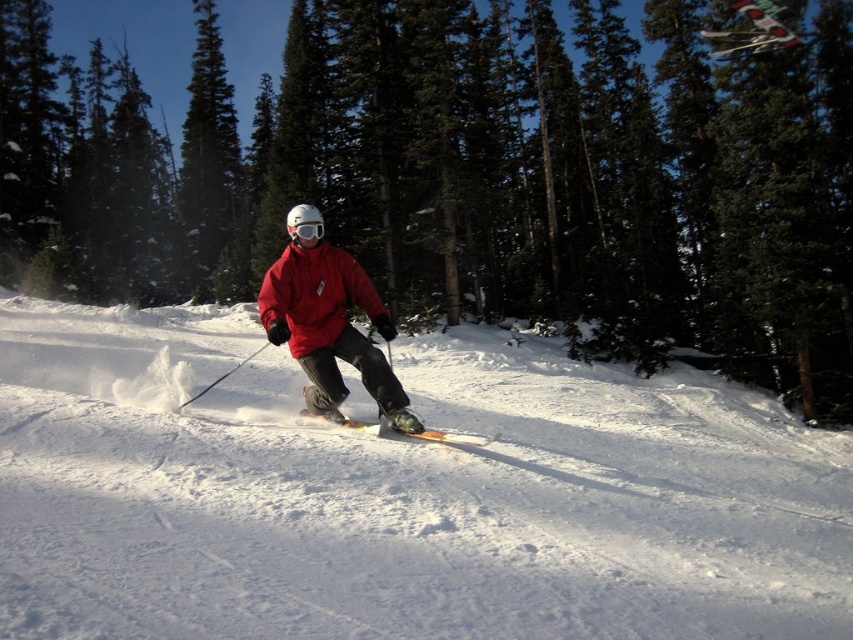
From the picture: Is green textured pine tree at center above orange metallic ski at center?

Yes, green textured pine tree at center is above orange metallic ski at center.

Does green textured pine tree at center have a greater height compared to orange metallic ski at center?

Correct, green textured pine tree at center is much taller as orange metallic ski at center.

Is point (793, 243) closer to camera compared to point (495, 436)?

No, it is behind (495, 436).

Identify the location of green textured pine tree at center. This screenshot has height=640, width=853. (473, 173).

Does matte red jacket at center come in front of white matte goggles at center?

Yes.

Is matte red jacket at center taller than white matte goggles at center?

Yes, matte red jacket at center is taller than white matte goggles at center.

Between point (289, 339) and point (311, 234), which one is positioned behind?

The point (289, 339) is behind.

Locate an element on the screen. Image resolution: width=853 pixels, height=640 pixels. matte red jacket at center is located at coordinates 315,294.

The image size is (853, 640). I want to click on matte red jacket at center, so click(315, 294).